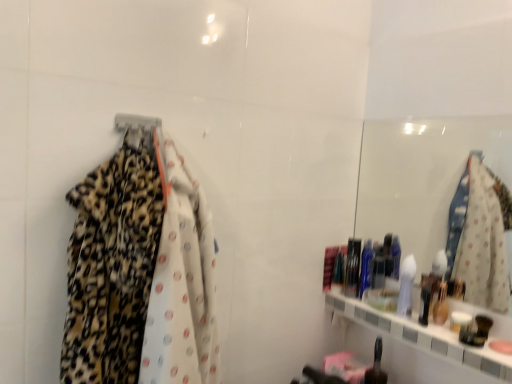
In order to face shiny black bottle at lower center, the 2th toiletry in the top-to-bottom sequence, should I rotate leftwards or rightwards?

You should rotate right by 16.076 degrees.

In order to click on metallic silver hanger at upper left in this screenshot , I will do `click(136, 122)`.

Considering the sizes of metallic silver hanger at upper left and shiny plastic container at right, which is the 1th toiletry in back-to-front order, in the image, is metallic silver hanger at upper left taller or shorter than shiny plastic container at right, which is the 1th toiletry in back-to-front order,?

Clearly, metallic silver hanger at upper left is shorter compared to shiny plastic container at right, which is the 1th toiletry in back-to-front order.

Consider the image. Which is more to the left, metallic silver hanger at upper left or shiny plastic container at right, the 2th toiletry from the front?

From the viewer's perspective, metallic silver hanger at upper left appears more on the left side.

Does metallic silver hanger at upper left have a smaller size compared to shiny plastic container at right, marked as the second toiletry in a bottom-to-top arrangement?

Yes.

Is metallic silver hanger at upper left spatially inside shiny plastic container at right, which is the 1th toiletry in back-to-front order, or outside of it?

metallic silver hanger at upper left is spatially situated outside shiny plastic container at right, which is the 1th toiletry in back-to-front order.

Between metallic silver hanger at upper left and shiny black bottle at lower center, positioned as the 1th toiletry in bottom-to-top order, which one appears on the left side from the viewer's perspective?

Positioned to the left is metallic silver hanger at upper left.

From the metallic silver hanger at upper left, count 1st toiletrys backward and point to it. Please provide its 2D coordinates.

[(376, 366)]

From the image's perspective, which one is positioned lower, metallic silver hanger at upper left or shiny black bottle at lower center, acting as the 1th toiletry starting from the front?

shiny black bottle at lower center, acting as the 1th toiletry starting from the front, from the image's perspective.

From the image's perspective, count 2nd toiletrys downward from the leopard print fabric at left and point to it. Please provide its 2D coordinates.

[(376, 366)]

From the image's perspective, is shiny black bottle at lower center, the 2th toiletry from the back, located above or below leopard print fabric at left?

Based on their image positions, shiny black bottle at lower center, the 2th toiletry from the back, is located beneath leopard print fabric at left.

From a real-world perspective, is shiny black bottle at lower center, the 2th toiletry from the back, located higher than leopard print fabric at left?

Actually, shiny black bottle at lower center, the 2th toiletry from the back, is physically below leopard print fabric at left in the real world.

Is shiny black bottle at lower center, acting as the 1th toiletry starting from the front, smaller than leopard print fabric at left?

Correct, shiny black bottle at lower center, acting as the 1th toiletry starting from the front, occupies less space than leopard print fabric at left.

Based on the photo, how different are the orientations of shiny black bottle at lower center, the 2th toiletry in the top-to-bottom sequence, and metallic silver hanger at upper left in degrees?

There is a 92.7-degree angle between the facing directions of shiny black bottle at lower center, the 2th toiletry in the top-to-bottom sequence, and metallic silver hanger at upper left.

From the image's perspective, is shiny black bottle at lower center, the 2th toiletry from the back, above or below metallic silver hanger at upper left?

Clearly, from the image's perspective, shiny black bottle at lower center, the 2th toiletry from the back, is below metallic silver hanger at upper left.

From a real-world perspective, is shiny black bottle at lower center, acting as the 1th toiletry starting from the front, located beneath metallic silver hanger at upper left?

Correct, in the physical world, shiny black bottle at lower center, acting as the 1th toiletry starting from the front, is lower than metallic silver hanger at upper left.

I want to click on hanger above the shiny black bottle at lower center, positioned as the 1th toiletry in bottom-to-top order (from a real-world perspective), so click(x=136, y=122).

In terms of height, does shiny plastic container at right, which is the 1th toiletry in back-to-front order, look taller or shorter compared to shiny black bottle at lower center, the 2th toiletry in the top-to-bottom sequence?

Clearly, shiny plastic container at right, which is the 1th toiletry in back-to-front order, is taller compared to shiny black bottle at lower center, the 2th toiletry in the top-to-bottom sequence.

Is shiny black bottle at lower center, the 2th toiletry in the top-to-bottom sequence, at the back of shiny plastic container at right, marked as the second toiletry in a bottom-to-top arrangement?

shiny plastic container at right, marked as the second toiletry in a bottom-to-top arrangement, does not have its back to shiny black bottle at lower center, the 2th toiletry in the top-to-bottom sequence.

Considering the relative positions of shiny plastic container at right, marked as the second toiletry in a bottom-to-top arrangement, and shiny black bottle at lower center, positioned as the 1th toiletry in bottom-to-top order, in the image provided, is shiny plastic container at right, marked as the second toiletry in a bottom-to-top arrangement, to the right of shiny black bottle at lower center, positioned as the 1th toiletry in bottom-to-top order, from the viewer's perspective?

No, shiny plastic container at right, marked as the second toiletry in a bottom-to-top arrangement, is not to the right of shiny black bottle at lower center, positioned as the 1th toiletry in bottom-to-top order.

Would you say shiny plastic container at right, the 2th toiletry from the front, contains shiny black bottle at lower center, the 2th toiletry from the back?

Definitely not — shiny black bottle at lower center, the 2th toiletry from the back, is not inside shiny plastic container at right, the 2th toiletry from the front.

Between metallic silver hanger at upper left and leopard print fabric at left, which one appears on the left side from the viewer's perspective?

From the viewer's perspective, metallic silver hanger at upper left appears more on the left side.

Is metallic silver hanger at upper left oriented towards leopard print fabric at left?

Yes, metallic silver hanger at upper left is oriented towards leopard print fabric at left.

Can you confirm if metallic silver hanger at upper left is bigger than leopard print fabric at left?

No, metallic silver hanger at upper left is not bigger than leopard print fabric at left.

Is the position of metallic silver hanger at upper left more distant than that of leopard print fabric at left?

Yes, it is.

Which object is more forward, shiny plastic container at right, which is the 1th toiletry in back-to-front order, or metallic silver hanger at upper left?

metallic silver hanger at upper left is more forward.

Could you tell me if shiny plastic container at right, which is the 1th toiletry from top to bottom, is turned towards metallic silver hanger at upper left?

No, shiny plastic container at right, which is the 1th toiletry from top to bottom, does not turn towards metallic silver hanger at upper left.

Between shiny plastic container at right, the 2th toiletry from the front, and metallic silver hanger at upper left, which one has smaller width?

Thinner between the two is metallic silver hanger at upper left.

From the image's perspective, which is below, shiny plastic container at right, the 2th toiletry from the front, or metallic silver hanger at upper left?

shiny plastic container at right, the 2th toiletry from the front.

There is a metallic silver hanger at upper left. Find the location of `the 1st toiletry below it (from the image's perspective)`. the 1st toiletry below it (from the image's perspective) is located at coordinates (352, 267).

Locate an element on the screen. Image resolution: width=512 pixels, height=384 pixels. hanger located above the shiny black bottle at lower center, positioned as the 1th toiletry in bottom-to-top order (from a real-world perspective) is located at coordinates (136, 122).

Estimate the real-world distances between objects in this image. Which object is further from metallic silver hanger at upper left, leopard print fabric at left or shiny plastic container at right, which is the 1th toiletry in back-to-front order?

shiny plastic container at right, which is the 1th toiletry in back-to-front order, lies further to metallic silver hanger at upper left than the other object.

Considering their positions, is metallic silver hanger at upper left positioned closer to leopard print fabric at left than shiny black bottle at lower center, the 2th toiletry in the top-to-bottom sequence?

Among the two, metallic silver hanger at upper left is located nearer to leopard print fabric at left.

Considering their positions, is shiny black bottle at lower center, acting as the 1th toiletry starting from the front, positioned closer to leopard print fabric at left than metallic silver hanger at upper left?

Among the two, metallic silver hanger at upper left is located nearer to leopard print fabric at left.

Looking at the image, which one is located further to shiny black bottle at lower center, positioned as the 1th toiletry in bottom-to-top order, shiny plastic container at right, the 2th toiletry from the front, or leopard print fabric at left?

Among the two, leopard print fabric at left is located further to shiny black bottle at lower center, positioned as the 1th toiletry in bottom-to-top order.

From the image, which object appears to be farther from metallic silver hanger at upper left, leopard print fabric at left or shiny black bottle at lower center, acting as the 1th toiletry starting from the front?

shiny black bottle at lower center, acting as the 1th toiletry starting from the front, is positioned further to the anchor metallic silver hanger at upper left.

When comparing their distances from metallic silver hanger at upper left, does shiny plastic container at right, marked as the second toiletry in a bottom-to-top arrangement, or shiny black bottle at lower center, acting as the 1th toiletry starting from the front, seem further?

shiny black bottle at lower center, acting as the 1th toiletry starting from the front, is positioned further to the anchor metallic silver hanger at upper left.

Estimate the real-world distances between objects in this image. Which object is closer to leopard print fabric at left, shiny plastic container at right, marked as the second toiletry in a bottom-to-top arrangement, or metallic silver hanger at upper left?

metallic silver hanger at upper left is positioned closer to the anchor leopard print fabric at left.

Estimate the real-world distances between objects in this image. Which object is further from shiny black bottle at lower center, the 2th toiletry from the back, leopard print fabric at left or metallic silver hanger at upper left?

The object further to shiny black bottle at lower center, the 2th toiletry from the back, is metallic silver hanger at upper left.

This screenshot has width=512, height=384. In order to click on hanger between leopard print fabric at left and shiny plastic container at right, which is the 1th toiletry from top to bottom, from front to back in this screenshot , I will do `click(136, 122)`.

At what (x,y) coordinates should I click in order to perform the action: click on toiletry between metallic silver hanger at upper left and shiny black bottle at lower center, positioned as the 1th toiletry in bottom-to-top order, in the horizontal direction. Please return your answer as a coordinate pair (x, y). Looking at the image, I should click on (352, 267).

Image resolution: width=512 pixels, height=384 pixels. Identify the location of fancy dress between metallic silver hanger at upper left and shiny black bottle at lower center, acting as the 1th toiletry starting from the front, from left to right. (140, 272).

Where is `toiletry between leopard print fabric at left and shiny plastic container at right, marked as the second toiletry in a bottom-to-top arrangement, along the z-axis`? toiletry between leopard print fabric at left and shiny plastic container at right, marked as the second toiletry in a bottom-to-top arrangement, along the z-axis is located at coordinates click(376, 366).